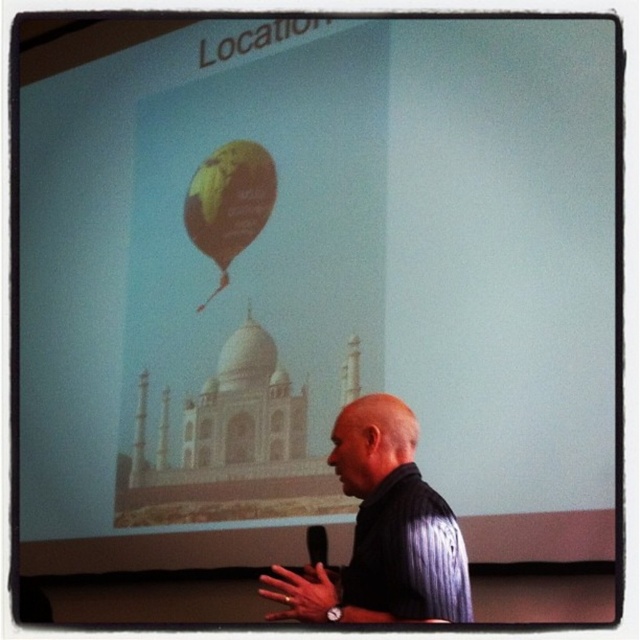
I want to click on black striped shirt at lower right, so click(381, 531).

Does point (452, 547) lie in front of point (224, 257)?

Yes, point (452, 547) is in front of point (224, 257).

This screenshot has height=640, width=640. I want to click on black striped shirt at lower right, so click(x=381, y=531).